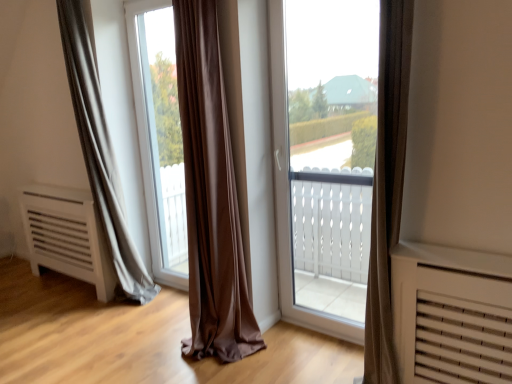
The width and height of the screenshot is (512, 384). In order to click on transparent glass window at center in this screenshot , I will do `click(288, 191)`.

You are a GUI agent. You are given a task and a screenshot of the screen. Output one action in this format:
    pyautogui.click(x=<x>, y=<y>)
    Task: Click on the matte gray curtain at left
    
    Given the screenshot: What is the action you would take?
    pyautogui.click(x=100, y=148)

Which is more to the left, transparent glass window at center or transparent glass window at center?

From the viewer's perspective, transparent glass window at center appears more on the left side.

Is transparent glass window at center smaller than transparent glass window at center?

No, transparent glass window at center is not smaller than transparent glass window at center.

Which object is closer to the camera, transparent glass window at center or transparent glass window at center?

transparent glass window at center is in front.

From a real-world perspective, relative to transparent glass window at center, is transparent glass window at center vertically above or below?

transparent glass window at center is situated lower than transparent glass window at center in the real world.

Between matte gray curtain at left and transparent glass window at center, which one is positioned in front?

Positioned in front is matte gray curtain at left.

Is matte gray curtain at left completely or partially outside of transparent glass window at center?

matte gray curtain at left is positioned outside transparent glass window at center.

Considering the points (101, 108) and (163, 184), which point is in front, point (101, 108) or point (163, 184)?

Point (101, 108)

Does matte gray curtain at left have a larger size compared to transparent glass window at center?

Yes, matte gray curtain at left is bigger than transparent glass window at center.

Between transparent glass window at center and matte gray curtain at left, which one appears on the left side from the viewer's perspective?

matte gray curtain at left.

Does transparent glass window at center turn towards matte gray curtain at left?

No.

Which is more distant, (x=278, y=217) or (x=111, y=162)?

Point (x=111, y=162)

Considering the sizes of objects matte gray curtain at left and transparent glass window at center in the image provided, who is bigger, matte gray curtain at left or transparent glass window at center?

matte gray curtain at left is bigger.

From a real-world perspective, which object rests below the other?

transparent glass window at center, from a real-world perspective.

Is matte gray curtain at left aimed at transparent glass window at center?

No.

Where is `curtain above the transparent glass window at center (from the image's perspective)`? Image resolution: width=512 pixels, height=384 pixels. curtain above the transparent glass window at center (from the image's perspective) is located at coordinates (100, 148).

Does transparent glass window at center appear on the right side of matte gray curtain at left?

Indeed, transparent glass window at center is positioned on the right side of matte gray curtain at left.

From a real-world perspective, does transparent glass window at center sit lower than matte gray curtain at left?

Yes.

What's the angular difference between transparent glass window at center and matte gray curtain at left's facing directions?

The angle between the facing direction of transparent glass window at center and the facing direction of matte gray curtain at left is 4.96 degrees.

Consider the image. Could you tell me if transparent glass window at center is facing matte gray curtain at left?

Yes, transparent glass window at center faces towards matte gray curtain at left.

Consider the image. Is transparent glass window at center wider than transparent glass window at center?

No, transparent glass window at center is not wider than transparent glass window at center.

Is transparent glass window at center placed right next to transparent glass window at center?

They are not placed beside each other.

In order to click on window screen located behind the transparent glass window at center in this screenshot , I will do `click(157, 140)`.

Where is `window screen that appears above the transparent glass window at center (from a real-world perspective)`? This screenshot has height=384, width=512. window screen that appears above the transparent glass window at center (from a real-world perspective) is located at coordinates point(157,140).

Locate an element on the screen. Image resolution: width=512 pixels, height=384 pixels. curtain below the transparent glass window at center (from the image's perspective) is located at coordinates (100, 148).

Looking at the image, which one is located further to matte gray curtain at left, transparent glass window at center or transparent glass window at center?

Among the two, transparent glass window at center is located further to matte gray curtain at left.

When comparing their distances from transparent glass window at center, does matte gray curtain at left or transparent glass window at center seem further?

matte gray curtain at left is positioned further to the anchor transparent glass window at center.

From the picture: From the image, which object appears to be nearer to transparent glass window at center, transparent glass window at center or matte gray curtain at left?

matte gray curtain at left is closer to transparent glass window at center.

From the image, which object appears to be nearer to transparent glass window at center, matte gray curtain at left or transparent glass window at center?

Among the two, matte gray curtain at left is located nearer to transparent glass window at center.

Estimate the real-world distances between objects in this image. Which object is closer to transparent glass window at center, transparent glass window at center or matte gray curtain at left?

transparent glass window at center is positioned closer to the anchor transparent glass window at center.

Considering their positions, is transparent glass window at center positioned closer to matte gray curtain at left than transparent glass window at center?

transparent glass window at center is positioned closer to the anchor matte gray curtain at left.

Image resolution: width=512 pixels, height=384 pixels. Find the location of `window screen located between matte gray curtain at left and transparent glass window at center in the left-right direction`. window screen located between matte gray curtain at left and transparent glass window at center in the left-right direction is located at coordinates (157, 140).